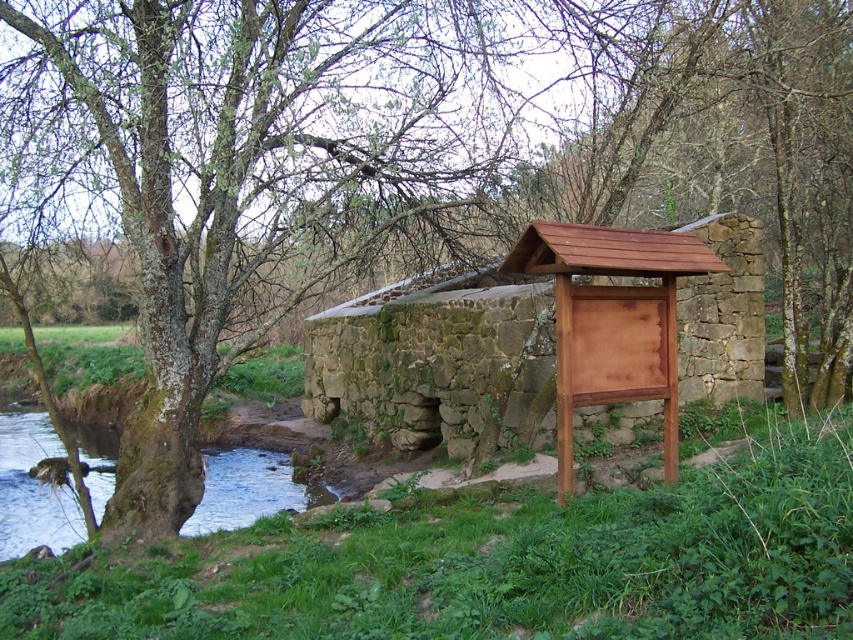
Question: Among these points, which one is farthest from the camera?

Choices:
 (A) (260, 458)
 (B) (512, 365)

Answer: (A)

Question: Can you confirm if brown wooden sign at center is bigger than clear water at lower left?

Choices:
 (A) no
 (B) yes

Answer: (B)

Question: Considering the relative positions of brown wooden sign at center and clear water at lower left in the image provided, where is brown wooden sign at center located with respect to clear water at lower left?

Choices:
 (A) below
 (B) above

Answer: (B)

Question: Which point appears farthest from the camera in this image?

Choices:
 (A) (418, 388)
 (B) (3, 506)

Answer: (A)

Question: Does brown wooden sign at center appear under clear water at lower left?

Choices:
 (A) no
 (B) yes

Answer: (A)

Question: Which of the following is the closest to the observer?

Choices:
 (A) clear water at lower left
 (B) brown wooden sign at center

Answer: (B)